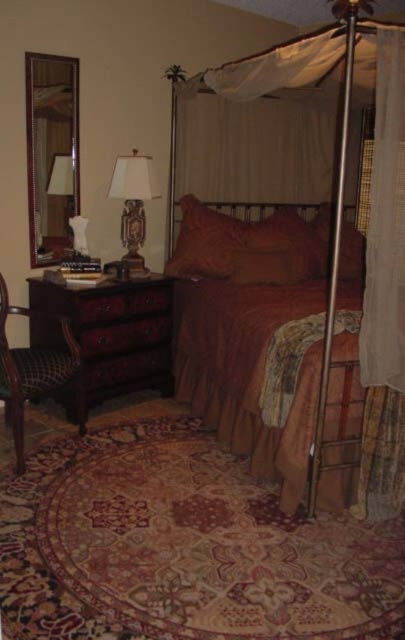
Can you confirm if matte brown fabric canopy bed at center is positioned above plaid fabric armchair at left?

Correct, matte brown fabric canopy bed at center is located above plaid fabric armchair at left.

Between matte brown fabric canopy bed at center and plaid fabric armchair at left, which one appears on the right side from the viewer's perspective?

matte brown fabric canopy bed at center

Between point (375, 340) and point (6, 305), which one is positioned behind?

The point (6, 305) is behind.

The width and height of the screenshot is (405, 640). In order to click on matte brown fabric canopy bed at center in this screenshot , I will do `click(300, 310)`.

Who is more forward, [168,291] or [113,182]?

Point [113,182]

Measure the distance from brown wood dresser at left to matte brown wood lamp at left.

brown wood dresser at left is 20.41 inches away from matte brown wood lamp at left.

Which is behind, point (132, 352) or point (121, 177)?

Point (132, 352)

Locate an element on the screen. This screenshot has width=405, height=640. brown wood dresser at left is located at coordinates (110, 332).

Between brown wood dresser at left and velvet-like brown pillow at center, which one has less height?

Standing shorter between the two is velvet-like brown pillow at center.

You are a GUI agent. You are given a task and a screenshot of the screen. Output one action in this format:
    pyautogui.click(x=<x>, y=<y>)
    Task: Click on the brown wood dresser at left
    This screenshot has width=405, height=640.
    Given the screenshot: What is the action you would take?
    pyautogui.click(x=110, y=332)